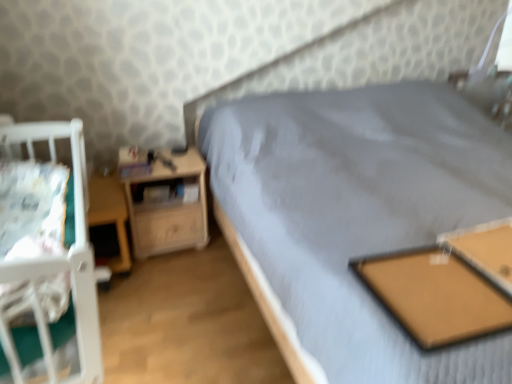
Question: Considering the positions of point (197, 221) and point (506, 228), is point (197, 221) closer or farther from the camera than point (506, 228)?

Choices:
 (A) farther
 (B) closer

Answer: (A)

Question: From a real-world perspective, relative to brown cork board at center, the second table when ordered from left to right, is wooden nightstand at left vertically above or below?

Choices:
 (A) above
 (B) below

Answer: (B)

Question: Estimate the real-world distances between objects in this image. Which object is closer to the white fabric sheet at left?

Choices:
 (A) wooden table at lower left, which is counted as the second table, starting from the right
 (B) brown cork board at center, the second table when ordered from left to right
 (C) wooden nightstand at left
 (D) white fabric infant bed at left

Answer: (D)

Question: Which object is the farthest from the wooden nightstand at left?

Choices:
 (A) wooden table at lower left, which is counted as the second table, starting from the front
 (B) brown cork board at center, marked as the second table in a back-to-front arrangement
 (C) white fabric infant bed at left
 (D) white fabric sheet at left

Answer: (B)